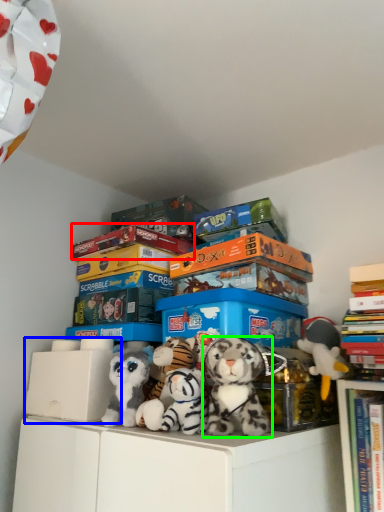
Question: Estimate the real-world distances between objects in this image. Which object is closer to book (highlighted by a red box), storage box (highlighted by a blue box) or toy (highlighted by a green box)?

Choices:
 (A) storage box
 (B) toy

Answer: (A)